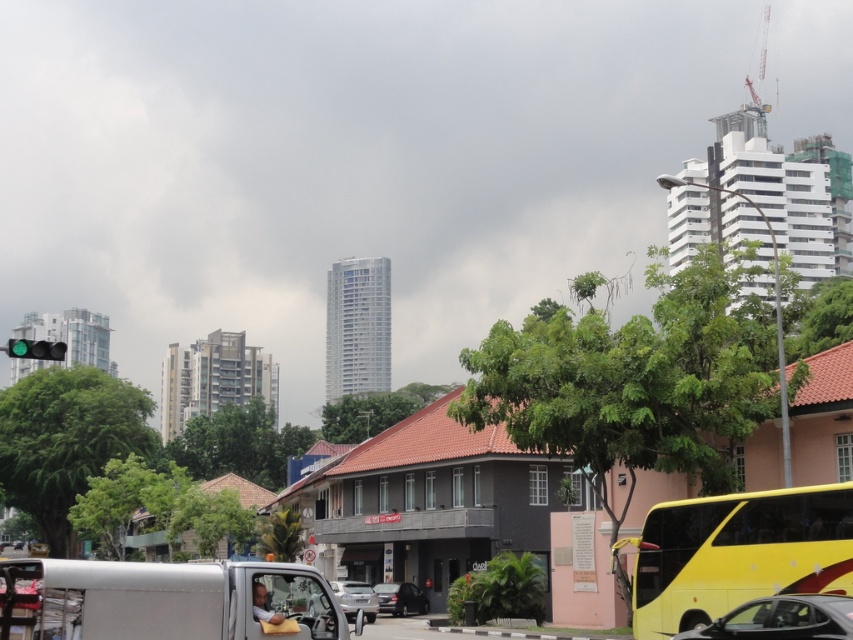
Question: Can you confirm if metallic silver car at lower right is positioned to the right of green glass traffic light at upper left?

Choices:
 (A) no
 (B) yes

Answer: (B)

Question: Which is nearer to the yellow matte/deck bus at lower right?

Choices:
 (A) yellow matte/decorative bus at lower right
 (B) green glass traffic light at upper left
 (C) silver metallic car at center

Answer: (A)

Question: Which object is the closest to the metallic silver car at lower right?

Choices:
 (A) silver metallic car at center
 (B) yellow matte/deck bus at lower right
 (C) green glass traffic light at upper left
 (D) yellow matte/decorative bus at lower right

Answer: (D)

Question: Can you confirm if yellow matte/decorative bus at lower right is positioned below metallic silver car at lower right?

Choices:
 (A) no
 (B) yes

Answer: (A)

Question: Among these points, which one is nearest to the camera?

Choices:
 (A) [28, 348]
 (B) [403, 614]

Answer: (A)

Question: Does silver metallic car at center have a larger size compared to green glass traffic light at upper left?

Choices:
 (A) yes
 (B) no

Answer: (B)